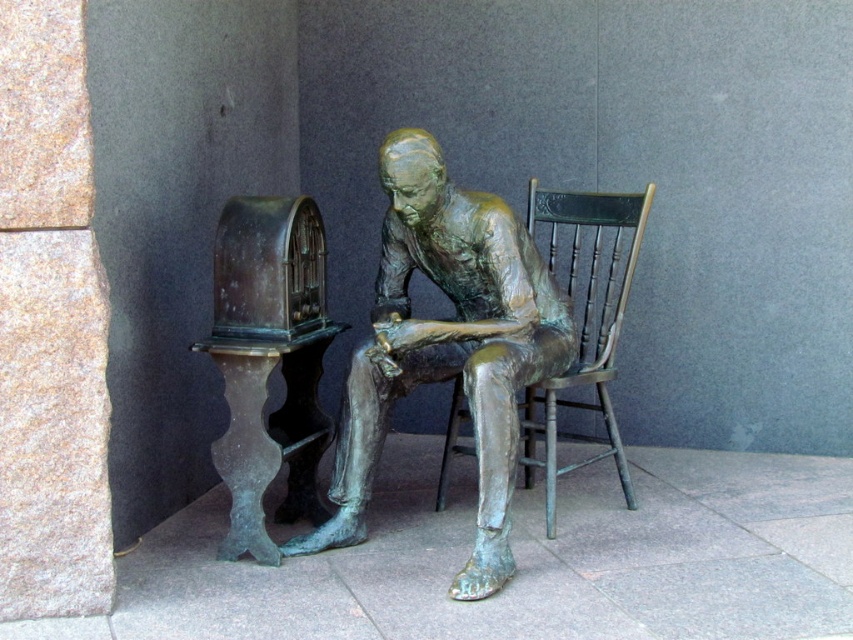
Which is more to the left, green patina statue at center or bronze wooden chair at center?

green patina statue at center

Find the location of `green patina statue at center`. green patina statue at center is located at coordinates (445, 346).